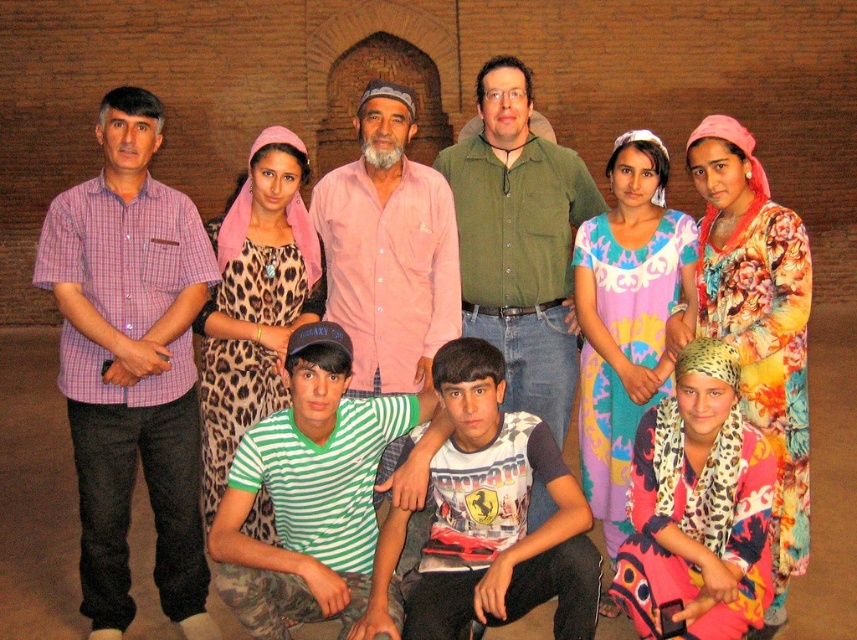
Question: Estimate the real-world distances between objects in this image. Which object is farther from the white printed t-shirt at center?

Choices:
 (A) plaid cotton shirt at left
 (B) leopard print dress at lower right

Answer: (A)

Question: Does plaid cotton shirt at left have a lesser width compared to leopard print dress at lower right?

Choices:
 (A) yes
 (B) no

Answer: (B)

Question: Based on their relative distances, which object is nearer to the green matte shirt at center?

Choices:
 (A) leopard print dress at lower right
 (B) white printed t-shirt at center
 (C) green striped shirt at center

Answer: (B)

Question: Is white printed t-shirt at center thinner than leopard print dress at lower right?

Choices:
 (A) no
 (B) yes

Answer: (A)

Question: Which of these objects is positioned farthest from the green striped shirt at center?

Choices:
 (A) leopard print dress at lower right
 (B) white printed t-shirt at center
 (C) green matte shirt at center

Answer: (C)

Question: Is the position of plaid cotton shirt at left less distant than that of green matte shirt at center?

Choices:
 (A) yes
 (B) no

Answer: (A)